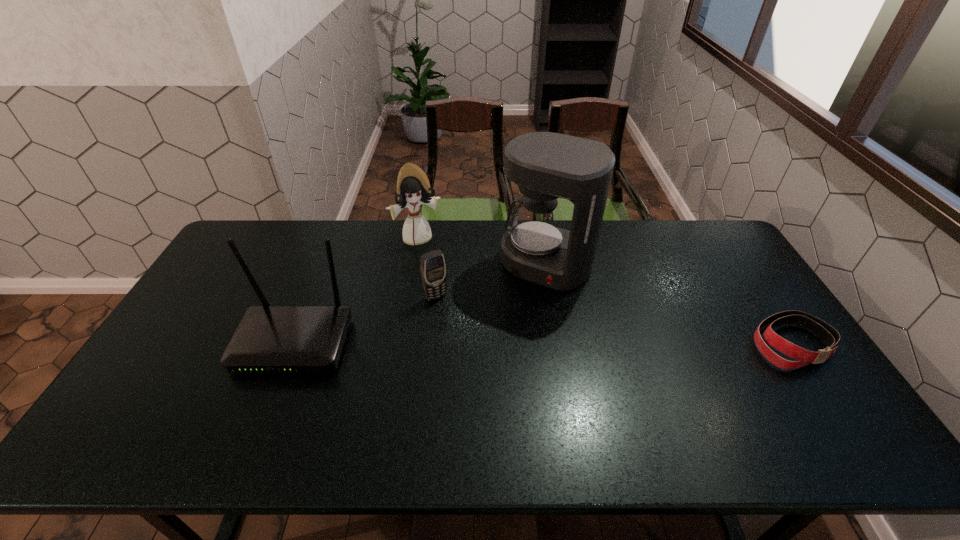
Where is `router`? The width and height of the screenshot is (960, 540). router is located at coordinates (269, 339).

What are the coordinates of `dog collar` in the screenshot? It's located at (829, 335).

Image resolution: width=960 pixels, height=540 pixels. In order to click on the rightmost object in this screenshot , I will do `click(829, 335)`.

Where is `coffee maker`? Image resolution: width=960 pixels, height=540 pixels. coffee maker is located at coordinates (545, 165).

Where is `the tallest object`? the tallest object is located at coordinates (545, 165).

I want to click on cellular telephone, so click(x=432, y=264).

In order to click on doll in this screenshot , I will do `click(413, 188)`.

At what (x,y) coordinates should I click in order to perform the action: click on vacant space situated 0.090m on the front-facing side of the leftmost object. Please return your answer as a coordinate pair (x, y). Looking at the image, I should click on (268, 409).

The image size is (960, 540). What are the coordinates of `free spot located 0.400m on the left of the dog collar` in the screenshot? It's located at (611, 343).

In order to click on vacant position located 0.230m on the front-facing side of the fourth object from left to right in this screenshot , I will do `click(498, 340)`.